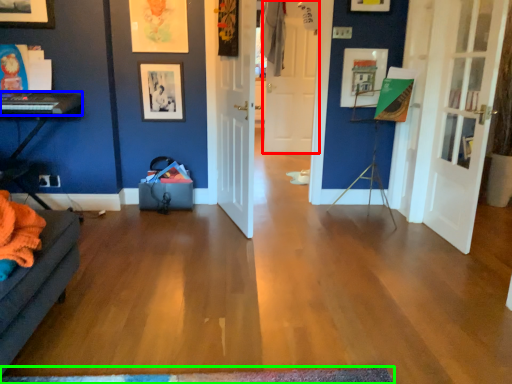
Question: Based on their relative distances, which object is farther from door (highlighted by a red box)? Choose from piano (highlighted by a blue box) and doormat (highlighted by a green box).

Choices:
 (A) piano
 (B) doormat

Answer: (B)